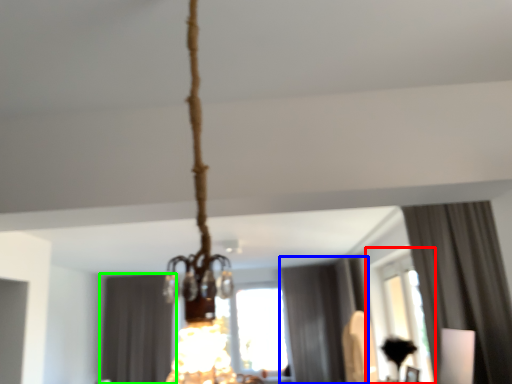
Question: Considering the real-world distances, which object is farthest from window (highlighted by a red box)? curtain (highlighted by a blue box) or curtain (highlighted by a green box)?

Choices:
 (A) curtain
 (B) curtain

Answer: (B)